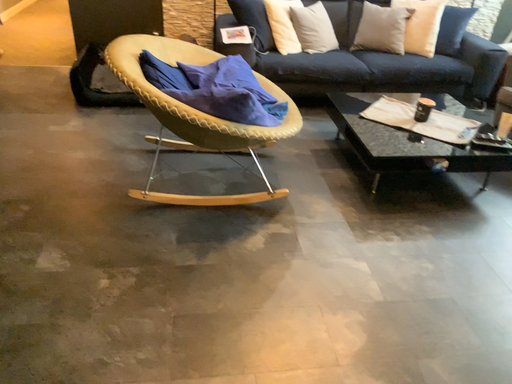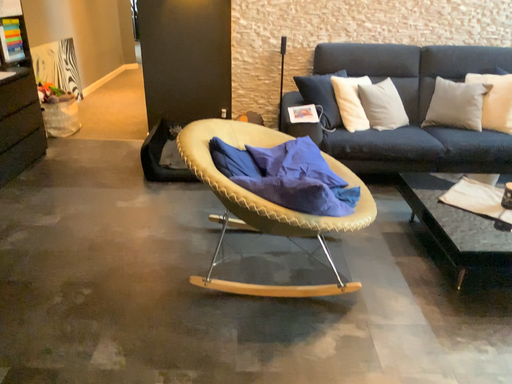
Question: How did the camera likely rotate when shooting the video?

Choices:
 (A) rotated right
 (B) rotated left

Answer: (B)